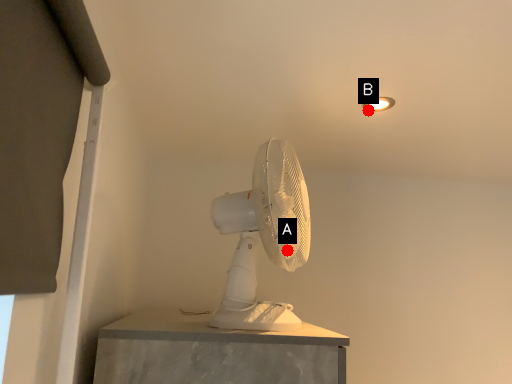
Question: Two points are circled on the image, labeled by A and B beside each circle. Which point is further to the camera?

Choices:
 (A) A is further
 (B) B is further

Answer: (B)